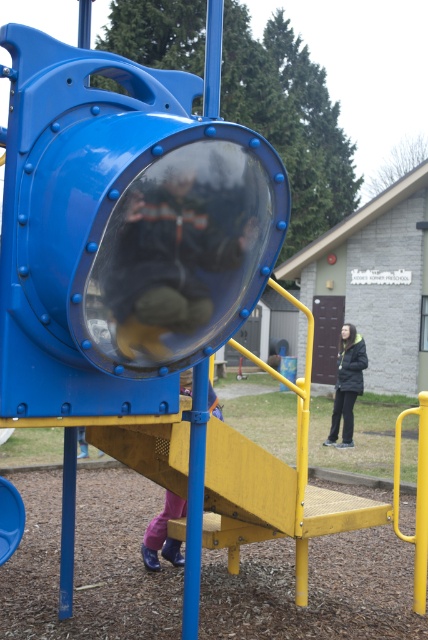
Question: Which is farther from the pink fabric pants at lower center?

Choices:
 (A) dark gray jacket at right
 (B) dark blue jacket at center

Answer: (A)

Question: Which object is positioned closest to the dark gray jacket at right?

Choices:
 (A) dark blue jacket at center
 (B) pink fabric pants at lower center

Answer: (B)

Question: Is dark gray jacket at right closer to the viewer compared to pink fabric pants at lower center?

Choices:
 (A) yes
 (B) no

Answer: (B)

Question: Does dark gray jacket at right have a greater width compared to pink fabric pants at lower center?

Choices:
 (A) no
 (B) yes

Answer: (B)

Question: Does dark gray jacket at right have a lesser width compared to pink fabric pants at lower center?

Choices:
 (A) yes
 (B) no

Answer: (B)

Question: Which object is the farthest from the dark blue jacket at center?

Choices:
 (A) dark gray jacket at right
 (B) pink fabric pants at lower center

Answer: (A)